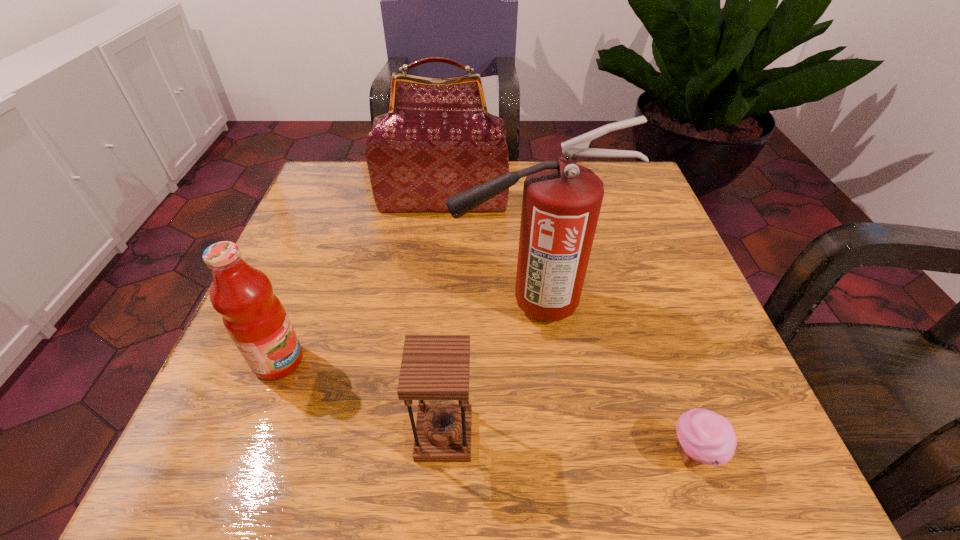
Locate an element on the screen. vacant space at the far edge of the desktop is located at coordinates (526, 166).

In the image, there is a desktop. At what (x,y) coordinates should I click in order to perform the action: click on vacant space at the near edge. Please return your answer as a coordinate pair (x, y). This screenshot has width=960, height=540. Looking at the image, I should click on (649, 447).

What are the coordinates of `vacant space at the left edge of the desktop` in the screenshot? It's located at (346, 272).

Locate an element on the screen. free region at the right edge of the desktop is located at coordinates (691, 308).

This screenshot has height=540, width=960. In the image, there is a desktop. Find the location of `free region at the far left corner`. free region at the far left corner is located at coordinates (354, 188).

Find the location of a particular element. The image size is (960, 540). blank space at the far right corner is located at coordinates (643, 208).

You are a GUI agent. You are given a task and a screenshot of the screen. Output one action in this format:
    pyautogui.click(x=<x>, y=<y>)
    Task: Click on the free space between the fourth tallest object and the rightmost object
    This screenshot has width=960, height=540.
    Given the screenshot: What is the action you would take?
    pyautogui.click(x=568, y=444)

I want to click on blank region between the handbag and the hourglass, so click(444, 319).

Locate an element on the screen. Image resolution: width=960 pixels, height=540 pixels. blank region between the farthest object and the cupcake is located at coordinates (568, 328).

At what (x,y) coordinates should I click in order to perform the action: click on free space between the fourth nearest object and the farthest object. Please return your answer as a coordinate pair (x, y). Looking at the image, I should click on (487, 253).